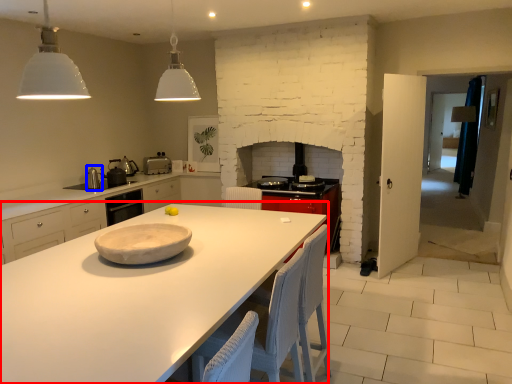
Question: Among these objects, which one is farthest to the camera, countertop (highlighted by a red box) or appliance (highlighted by a blue box)?

Choices:
 (A) countertop
 (B) appliance

Answer: (B)